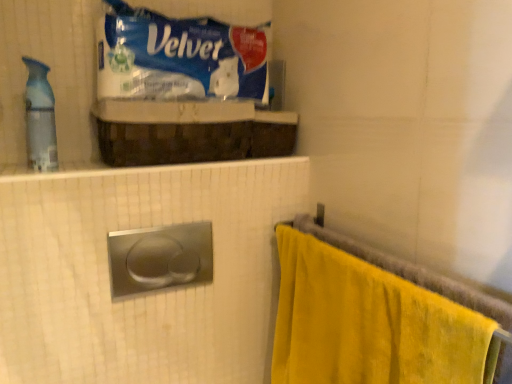
Question: Is translucent plastic spray bottle at left aimed at blue plastic velver at upper center?

Choices:
 (A) no
 (B) yes

Answer: (A)

Question: Does translucent plastic spray bottle at left have a greater height compared to blue plastic velver at upper center?

Choices:
 (A) yes
 (B) no

Answer: (A)

Question: Is translucent plastic spray bottle at left at the right side of blue plastic velver at upper center?

Choices:
 (A) yes
 (B) no

Answer: (B)

Question: Is translucent plastic spray bottle at left wider than blue plastic velver at upper center?

Choices:
 (A) no
 (B) yes

Answer: (A)

Question: Is translucent plastic spray bottle at left thinner than blue plastic velver at upper center?

Choices:
 (A) yes
 (B) no

Answer: (A)

Question: Considering the positions of point (117, 79) and point (281, 316), is point (117, 79) closer or farther from the camera than point (281, 316)?

Choices:
 (A) farther
 (B) closer

Answer: (B)

Question: Considering the positions of blue plastic velver at upper center and yellow velour towel at right in the image, is blue plastic velver at upper center bigger or smaller than yellow velour towel at right?

Choices:
 (A) big
 (B) small

Answer: (B)

Question: Do you think blue plastic velver at upper center is within yellow velour towel at right, or outside of it?

Choices:
 (A) outside
 (B) inside

Answer: (A)

Question: Is blue plastic velver at upper center wider or thinner than yellow velour towel at right?

Choices:
 (A) thin
 (B) wide

Answer: (B)

Question: Is translucent plastic spray bottle at left to the left or to the right of blue plastic velver at upper center in the image?

Choices:
 (A) left
 (B) right

Answer: (A)

Question: In terms of height, does translucent plastic spray bottle at left look taller or shorter compared to blue plastic velver at upper center?

Choices:
 (A) tall
 (B) short

Answer: (A)

Question: In terms of width, does translucent plastic spray bottle at left look wider or thinner when compared to blue plastic velver at upper center?

Choices:
 (A) thin
 (B) wide

Answer: (A)

Question: Considering the positions of translucent plastic spray bottle at left and blue plastic velver at upper center in the image, is translucent plastic spray bottle at left bigger or smaller than blue plastic velver at upper center?

Choices:
 (A) big
 (B) small

Answer: (B)

Question: Considering their positions, is yellow velour towel at right located in front of or behind blue plastic velver at upper center?

Choices:
 (A) front
 (B) behind

Answer: (A)

Question: From the image's perspective, is yellow velour towel at right positioned above or below blue plastic velver at upper center?

Choices:
 (A) below
 (B) above

Answer: (A)